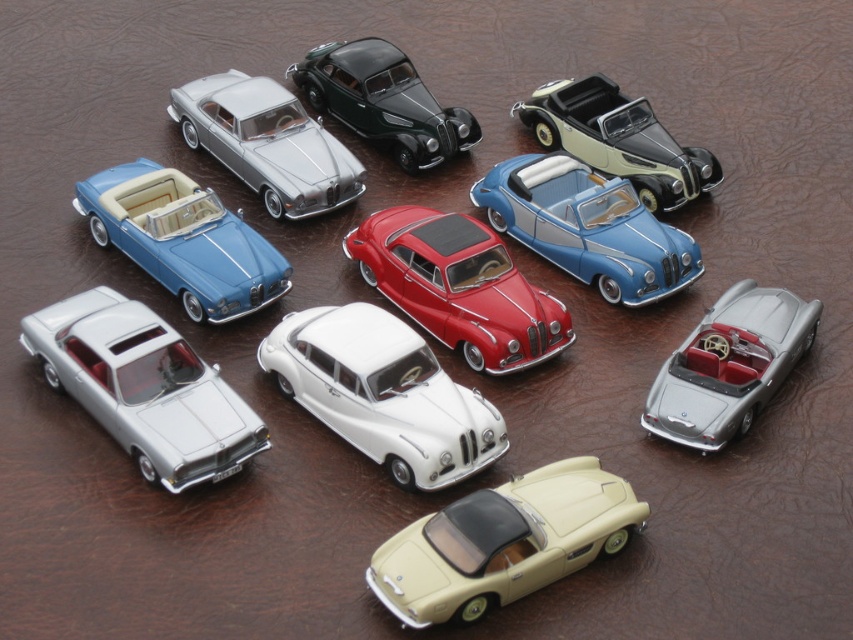
From the picture: Is the position of beige glossy convertible at center less distant than that of shiny red car at center?

Yes, beige glossy convertible at center is in front of shiny red car at center.

Who is positioned more to the right, beige glossy convertible at center or shiny red car at center?

Positioned to the right is beige glossy convertible at center.

Locate an element on the screen. beige glossy convertible at center is located at coordinates click(503, 541).

The height and width of the screenshot is (640, 853). Identify the location of beige glossy convertible at center. (503, 541).

Is point (462, 449) positioned behind point (582, 97)?

No, (462, 449) is closer to viewer.

The image size is (853, 640). I want to click on white glossy sedan at center, so click(383, 394).

This screenshot has width=853, height=640. What do you see at coordinates (383, 394) in the screenshot?
I see `white glossy sedan at center` at bounding box center [383, 394].

What are the coordinates of `white glossy sedan at center` in the screenshot? It's located at (383, 394).

How much distance is there between metallic silver convertible at center right and matte silver car at upper left?

metallic silver convertible at center right is 6.92 meters away from matte silver car at upper left.

Where is `metallic silver convertible at center right`? metallic silver convertible at center right is located at coordinates (729, 365).

Who is more forward, (732,432) or (300,115)?

Positioned in front is point (732,432).

Where is `metallic silver convertible at center right`? The height and width of the screenshot is (640, 853). metallic silver convertible at center right is located at coordinates (729, 365).